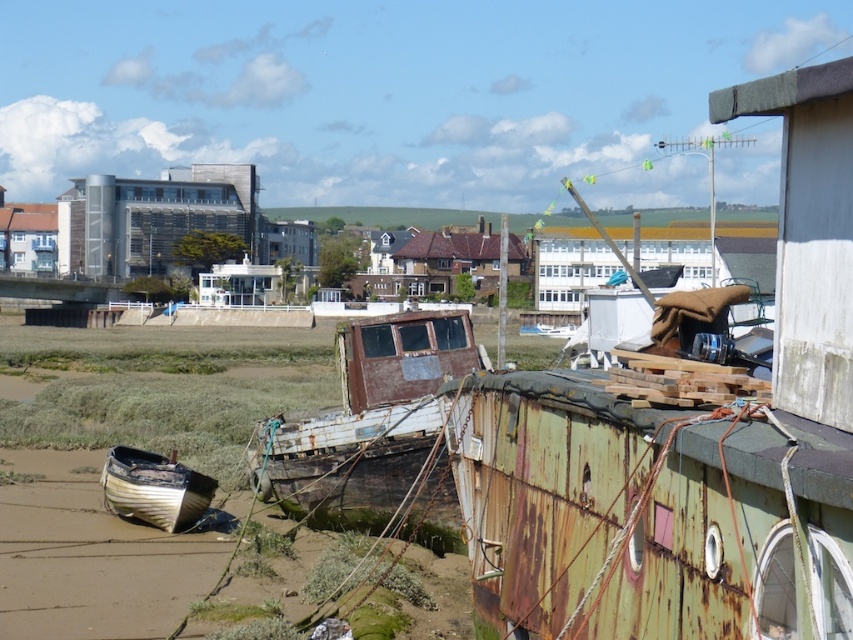
Does smooth brown sand at lower left have a lesser width compared to wooden boat at lower left?

Incorrect, smooth brown sand at lower left's width is not less than wooden boat at lower left's.

Which is below, smooth brown sand at lower left or wooden boat at lower left?

smooth brown sand at lower left is below.

Does point (196, 632) lie behind point (129, 452)?

No, it is not.

Find the location of a particular element. The height and width of the screenshot is (640, 853). smooth brown sand at lower left is located at coordinates (96, 556).

Can you confirm if rusty wood boat at center is positioned above wooden boat at lower left?

Indeed, rusty wood boat at center is positioned over wooden boat at lower left.

Is point (363, 332) positioned before point (111, 488)?

That is True.

The height and width of the screenshot is (640, 853). In order to click on rusty wood boat at center in this screenshot , I will do `click(374, 429)`.

Does point (62, 563) lie behind point (352, 456)?

No, (62, 563) is closer to viewer.

Is smooth brown sand at lower left closer to the viewer compared to rusty wood boat at center?

Yes, smooth brown sand at lower left is in front of rusty wood boat at center.

Who is more distant from viewer, (242,493) or (364,381)?

The point (242,493) is more distant.

Identify the location of smooth brown sand at lower left. The height and width of the screenshot is (640, 853). [96, 556].